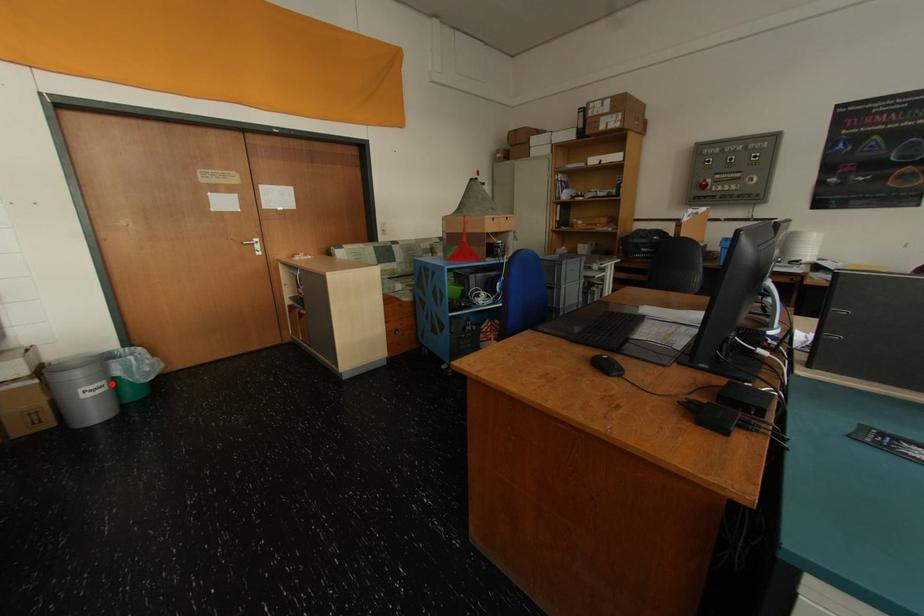
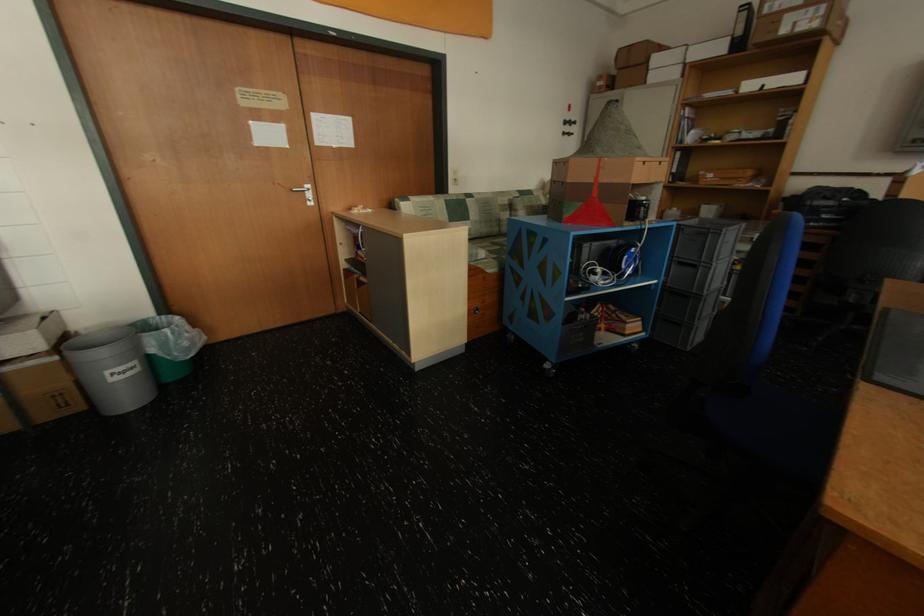
Find the pixel in the second image that matches the highlighted location in the first image.

(142, 363)